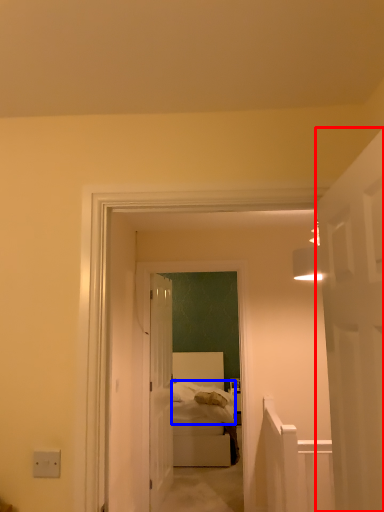
Question: Which of the following is the closest to the observer, door (highlighted by a red box) or bedding (highlighted by a blue box)?

Choices:
 (A) door
 (B) bedding

Answer: (A)